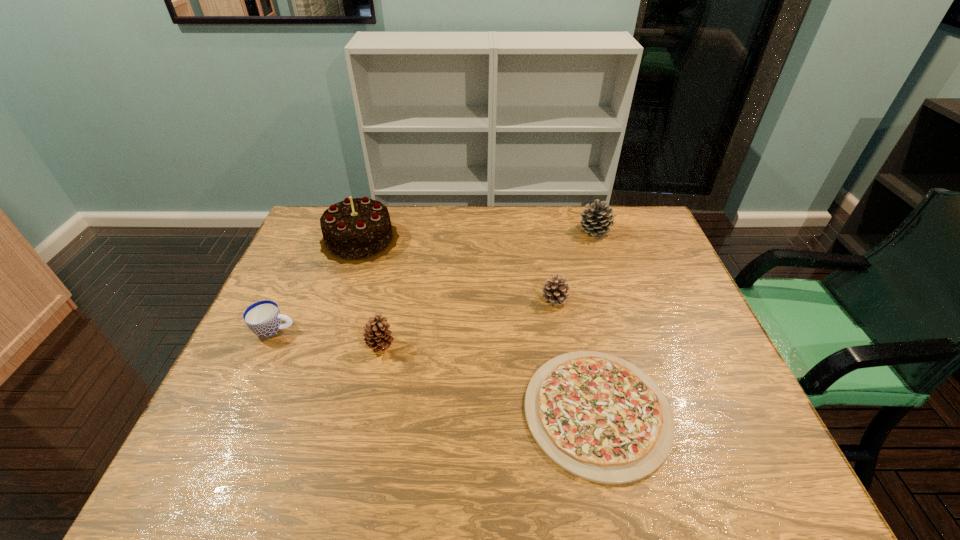
You are a GUI agent. You are given a task and a screenshot of the screen. Output one action in this format:
    pyautogui.click(x=<x>, y=<y>)
    Task: Click on the object present at the far right corner
    Image resolution: width=960 pixels, height=540 pixels.
    Given the screenshot: What is the action you would take?
    pyautogui.click(x=596, y=221)

Identify the location of free space at the far edge of the desktop. The width and height of the screenshot is (960, 540). (564, 245).

Identify the location of free space at the near edge. The image size is (960, 540). (284, 478).

I want to click on vacant space at the left edge, so click(261, 428).

Where is `free space at the right edge of the desktop`? free space at the right edge of the desktop is located at coordinates (714, 398).

At what (x,y) coordinates should I click in order to perform the action: click on free space at the far right corner of the desktop. Please return your answer as a coordinate pair (x, y). This screenshot has height=540, width=960. Looking at the image, I should click on (649, 244).

You are a GUI agent. You are given a task and a screenshot of the screen. Output one action in this format:
    pyautogui.click(x=<x>, y=<y>)
    Task: Click on the empty space between the second pinecone from left to right and the rightmost pinecone
    The width and height of the screenshot is (960, 540).
    Given the screenshot: What is the action you would take?
    pyautogui.click(x=575, y=265)

I want to click on vacant space that's between the farthest pinecone and the shortest object, so click(596, 321).

Find the location of `free spot between the rightmost pinecone and the nearest pinecone`. free spot between the rightmost pinecone and the nearest pinecone is located at coordinates (488, 288).

Identify the location of unoccupied position between the second shortest object and the fourth tallest object. (415, 314).